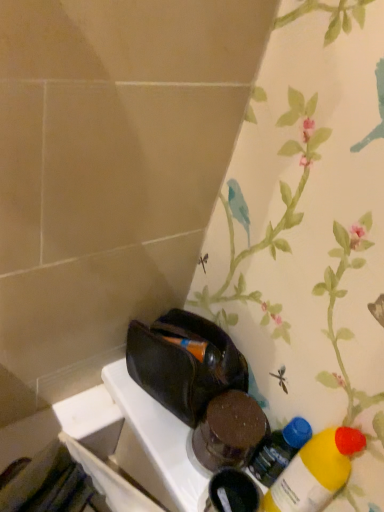
Question: Can we say translucent plastic bottle at lower right, marked as the 1th bottle in a back-to-front arrangement, lies outside yellow matte bottle at lower right, which appears as the second bottle when viewed from the back?

Choices:
 (A) yes
 (B) no

Answer: (A)

Question: Is translucent plastic bottle at lower right, marked as the 1th bottle in a back-to-front arrangement, taller than yellow matte bottle at lower right, which appears as the second bottle when viewed from the back?

Choices:
 (A) yes
 (B) no

Answer: (B)

Question: From a real-world perspective, is translucent plastic bottle at lower right, which is the second bottle from front to back, under yellow matte bottle at lower right, which appears as the second bottle when viewed from the back?

Choices:
 (A) no
 (B) yes

Answer: (B)

Question: Is translucent plastic bottle at lower right, which is the second bottle from front to back, at the right side of yellow matte bottle at lower right, which appears as the second bottle when viewed from the back?

Choices:
 (A) no
 (B) yes

Answer: (A)

Question: Does translucent plastic bottle at lower right, marked as the 1th bottle in a back-to-front arrangement, have a smaller size compared to yellow matte bottle at lower right, the 1th bottle from the front?

Choices:
 (A) yes
 (B) no

Answer: (A)

Question: Is translucent plastic bottle at lower right, which is the second bottle from front to back, shorter than yellow matte bottle at lower right, which appears as the second bottle when viewed from the back?

Choices:
 (A) yes
 (B) no

Answer: (A)

Question: Can you confirm if yellow matte bottle at lower right, which appears as the second bottle when viewed from the back, is smaller than translucent plastic bottle at lower right, marked as the 1th bottle in a back-to-front arrangement?

Choices:
 (A) yes
 (B) no

Answer: (B)

Question: Considering the relative positions of yellow matte bottle at lower right, the 1th bottle from the front, and translucent plastic bottle at lower right, marked as the 1th bottle in a back-to-front arrangement, in the image provided, is yellow matte bottle at lower right, the 1th bottle from the front, to the right of translucent plastic bottle at lower right, marked as the 1th bottle in a back-to-front arrangement, from the viewer's perspective?

Choices:
 (A) yes
 (B) no

Answer: (A)

Question: Is the position of yellow matte bottle at lower right, the 1th bottle from the front, more distant than that of translucent plastic bottle at lower right, which is the second bottle from front to back?

Choices:
 (A) no
 (B) yes

Answer: (A)

Question: Is yellow matte bottle at lower right, the 1th bottle from the front, facing away from translucent plastic bottle at lower right, which is the second bottle from front to back?

Choices:
 (A) yes
 (B) no

Answer: (B)

Question: Is yellow matte bottle at lower right, which appears as the second bottle when viewed from the back, in front of translucent plastic bottle at lower right, marked as the 1th bottle in a back-to-front arrangement?

Choices:
 (A) no
 (B) yes

Answer: (B)

Question: Is yellow matte bottle at lower right, which appears as the second bottle when viewed from the back, bigger than translucent plastic bottle at lower right, which is the second bottle from front to back?

Choices:
 (A) yes
 (B) no

Answer: (A)

Question: Relative to translucent plastic bottle at lower right, which is the second bottle from front to back, is yellow matte bottle at lower right, the 1th bottle from the front, in front or behind?

Choices:
 (A) behind
 (B) front

Answer: (B)